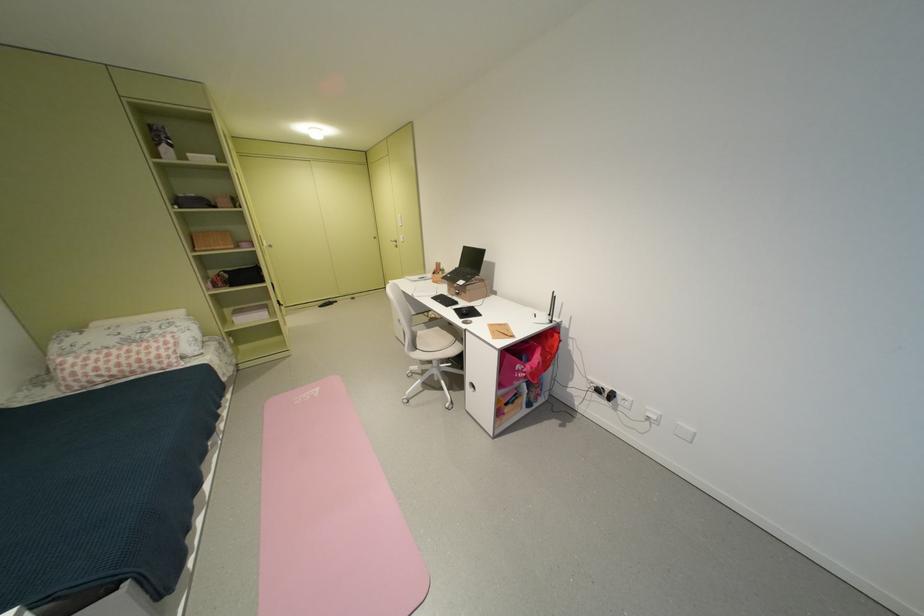
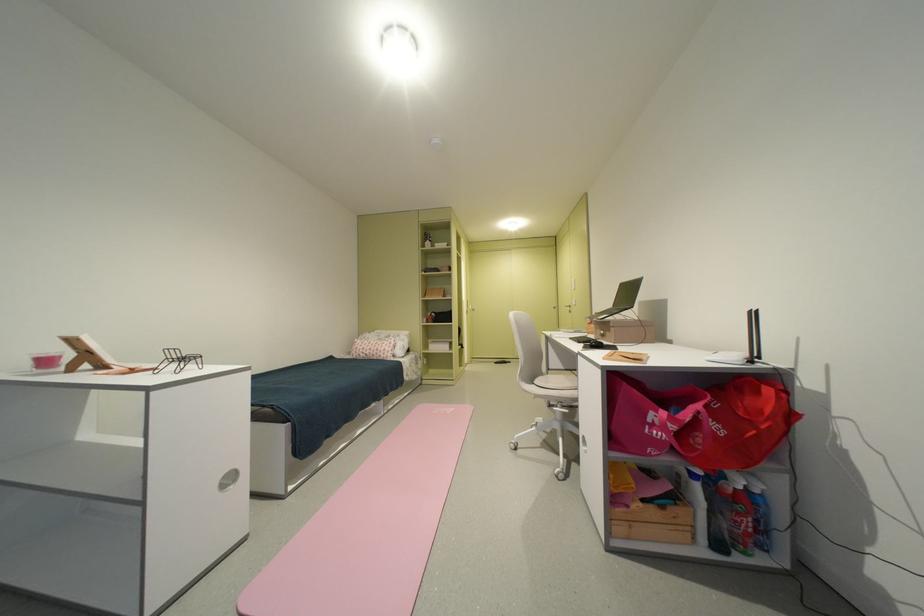
Find the pixel in the second image that matches (x=514, y=416) in the first image.

(638, 508)